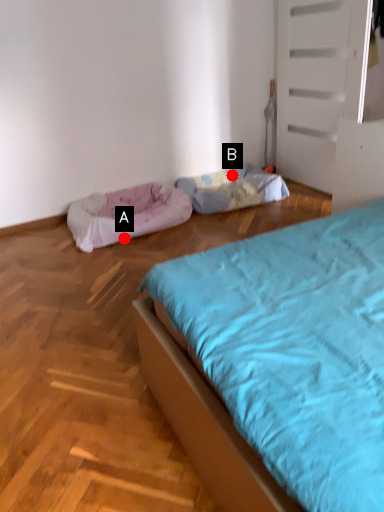
Question: Two points are circled on the image, labeled by A and B beside each circle. Which point is further to the camera?

Choices:
 (A) A is further
 (B) B is further

Answer: (B)